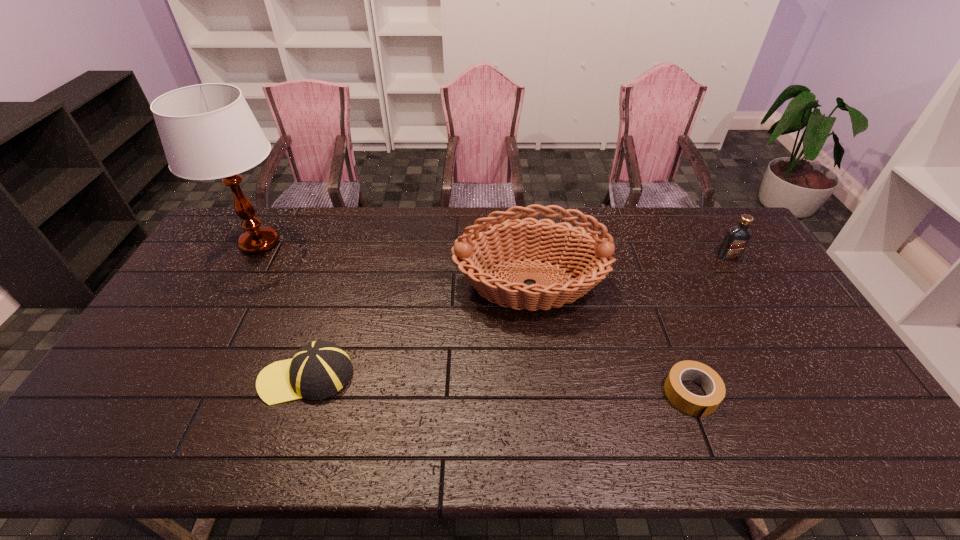
Where is `blank space located on the front of the tallest object`? This screenshot has width=960, height=540. blank space located on the front of the tallest object is located at coordinates (215, 322).

Where is `free location located 0.170m on the left of the third object from left to right`? Image resolution: width=960 pixels, height=540 pixels. free location located 0.170m on the left of the third object from left to right is located at coordinates (399, 284).

Image resolution: width=960 pixels, height=540 pixels. Find the location of `free space located on the front-facing side of the vodka`. free space located on the front-facing side of the vodka is located at coordinates (774, 330).

At what (x,y) coordinates should I click in order to perform the action: click on vacant space located with the brim of the second shortest object facing forward. Please return your answer as a coordinate pair (x, y). The height and width of the screenshot is (540, 960). Looking at the image, I should click on (132, 376).

The width and height of the screenshot is (960, 540). Find the location of `vacant space located 0.200m with the brim of the second shortest object facing forward`. vacant space located 0.200m with the brim of the second shortest object facing forward is located at coordinates (185, 376).

At what (x,y) coordinates should I click in order to perform the action: click on vacant space located with the brim of the second shortest object facing forward. Please return your answer as a coordinate pair (x, y). Looking at the image, I should click on (208, 376).

I want to click on object located at the far edge, so click(x=208, y=131).

Locate an element on the screen. This screenshot has width=960, height=540. object that is at the left edge is located at coordinates (208, 131).

Find the location of a particular element. This screenshot has width=960, height=540. object located in the right edge section of the desktop is located at coordinates (736, 239).

At what (x,y) coordinates should I click in order to perform the action: click on object situated at the far left corner. Please return your answer as a coordinate pair (x, y). The image size is (960, 540). Looking at the image, I should click on (208, 131).